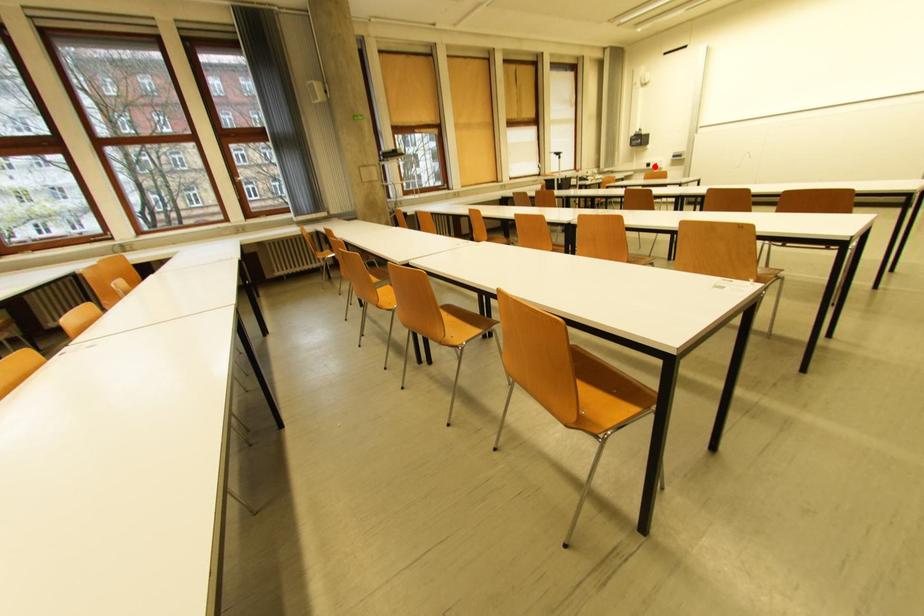
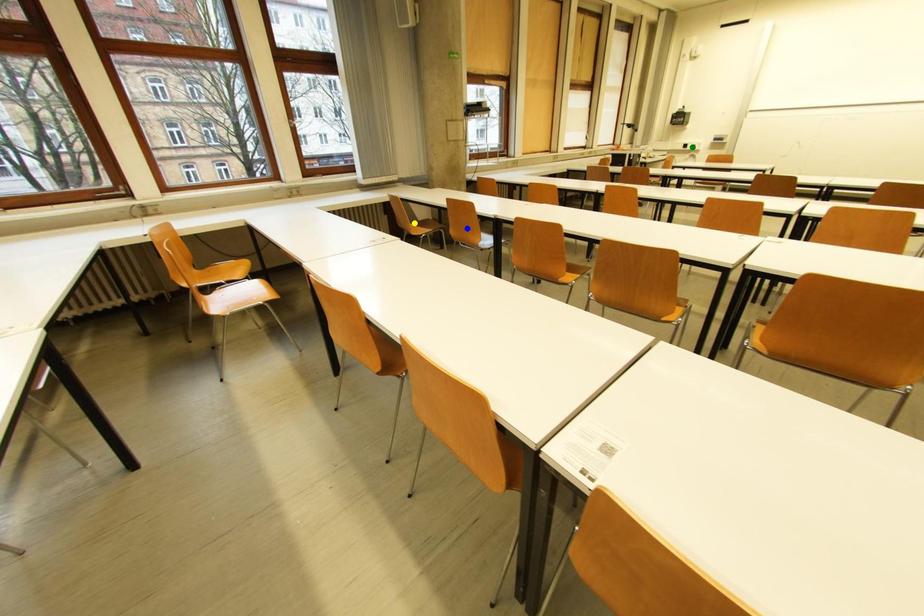
Question: I am providing you with two images of the same scene from different viewpoints. A red point is marked on the first image. You are given multiple points on the second image. Which mark in image 2 goes with the point in image 1?

Choices:
 (A) yellow point
 (B) green point
 (C) blue point

Answer: (B)